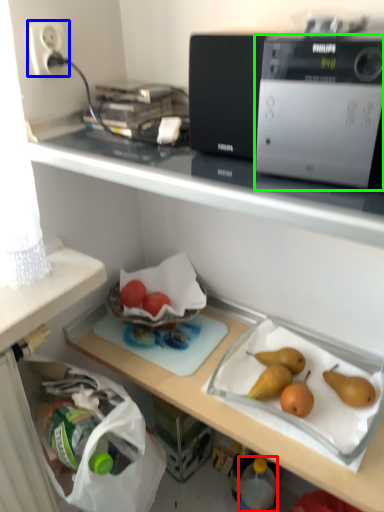
Question: Which is nearer to the bottle (highlighted by a red box)? electric outlet (highlighted by a blue box) or home appliance (highlighted by a green box).

Choices:
 (A) electric outlet
 (B) home appliance

Answer: (B)